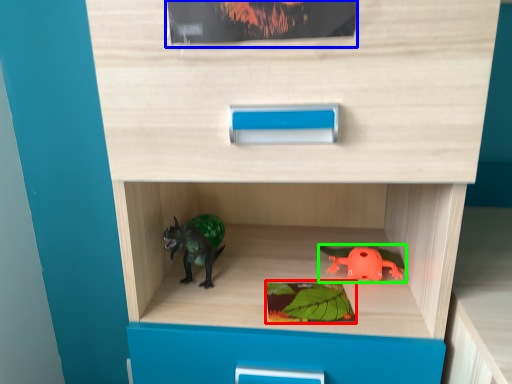
Question: Considering the real-world distances, which object is farthest from paperback book (highlighted by a red box)? paperback book (highlighted by a blue box) or toy (highlighted by a green box)?

Choices:
 (A) paperback book
 (B) toy

Answer: (A)